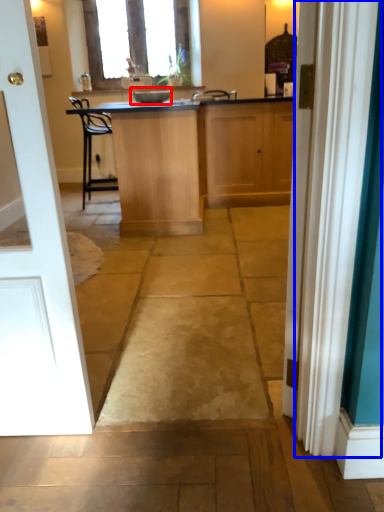
Question: Which object appears closest to the camera in this image, appliance (highlighted by a red box) or curtain (highlighted by a blue box)?

Choices:
 (A) appliance
 (B) curtain

Answer: (B)